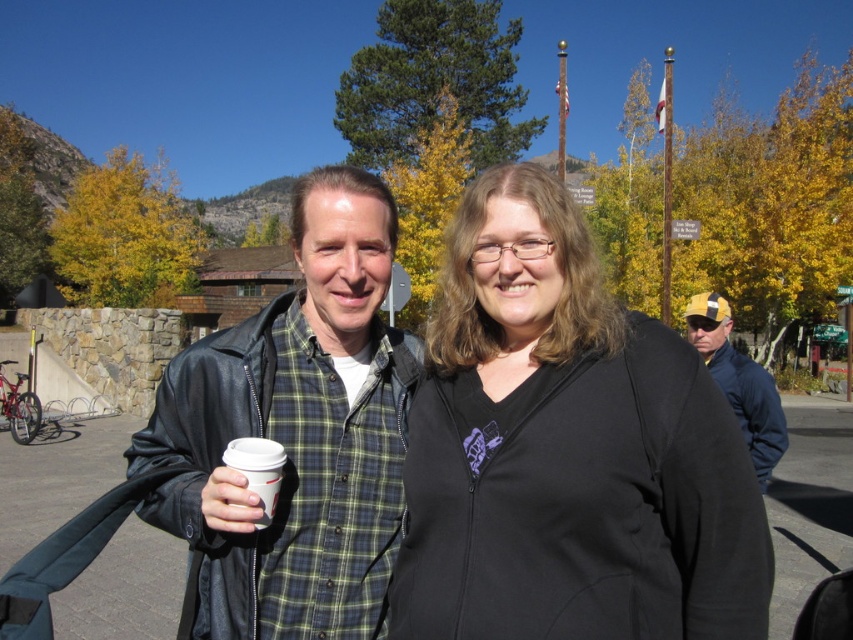
Does black zip-up hoodie at center have a smaller size compared to leather jacket at center?

Correct, black zip-up hoodie at center occupies less space than leather jacket at center.

Can you confirm if black zip-up hoodie at center is bigger than leather jacket at center?

No.

Does point (712, 477) come farther from viewer compared to point (175, 509)?

No, (712, 477) is in front of (175, 509).

Where is `black zip-up hoodie at center`? black zip-up hoodie at center is located at coordinates pos(566,451).

Between black zip-up hoodie at center and white paper cup at center, which one appears on the left side from the viewer's perspective?

From the viewer's perspective, white paper cup at center appears more on the left side.

Is black zip-up hoodie at center behind white paper cup at center?

That is False.

Which is in front, point (447, 451) or point (265, 512)?

Point (265, 512) is more forward.

Locate an element on the screen. black zip-up hoodie at center is located at coordinates (566, 451).

Between point (524, 614) and point (741, 419), which one is positioned in front?

Point (524, 614)

Does black zip-up hoodie at center have a smaller size compared to yellow cap at right?

No.

Does point (514, 636) come closer to viewer compared to point (757, 396)?

Yes, point (514, 636) is closer to viewer.

Identify the location of black zip-up hoodie at center. Image resolution: width=853 pixels, height=640 pixels. (566, 451).